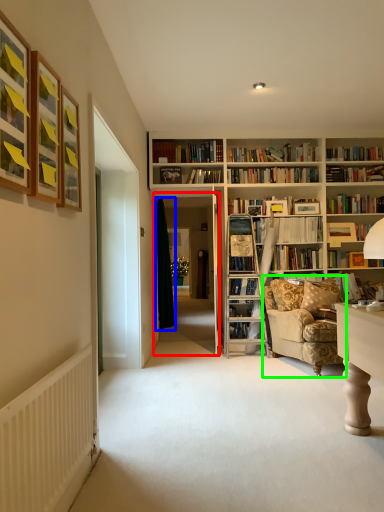
Question: Which is nearer to the glass door (highlighted by a red box)? curtain (highlighted by a blue box) or chair (highlighted by a green box).

Choices:
 (A) curtain
 (B) chair

Answer: (A)